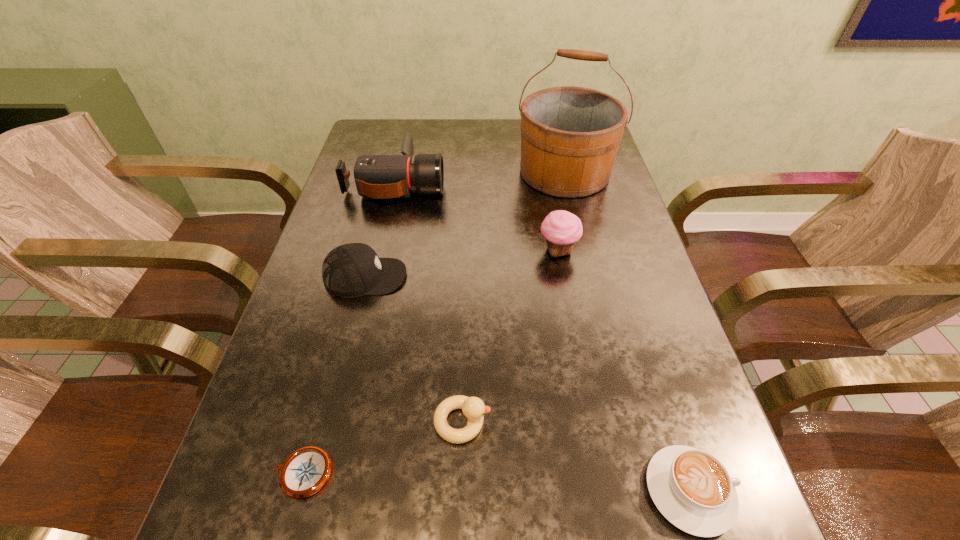
In order to click on the tallest object in this screenshot , I will do `click(570, 136)`.

This screenshot has width=960, height=540. Find the location of `camcorder`. camcorder is located at coordinates (376, 176).

Locate an element on the screen. The width and height of the screenshot is (960, 540). cupcake is located at coordinates (562, 229).

Image resolution: width=960 pixels, height=540 pixels. Identify the location of cap. (353, 269).

I want to click on the fifth farthest object, so click(x=473, y=408).

Identify the location of duckling. This screenshot has width=960, height=540. (473, 408).

Where is `cappuccino`? This screenshot has width=960, height=540. cappuccino is located at coordinates (692, 489).

The image size is (960, 540). I want to click on the shortest object, so click(305, 471).

The height and width of the screenshot is (540, 960). I want to click on blank space located on the left of the tallest object, so pyautogui.click(x=399, y=172).

Locate an element on the screen. The image size is (960, 540). free space located on the lens of the camcorder is located at coordinates (501, 183).